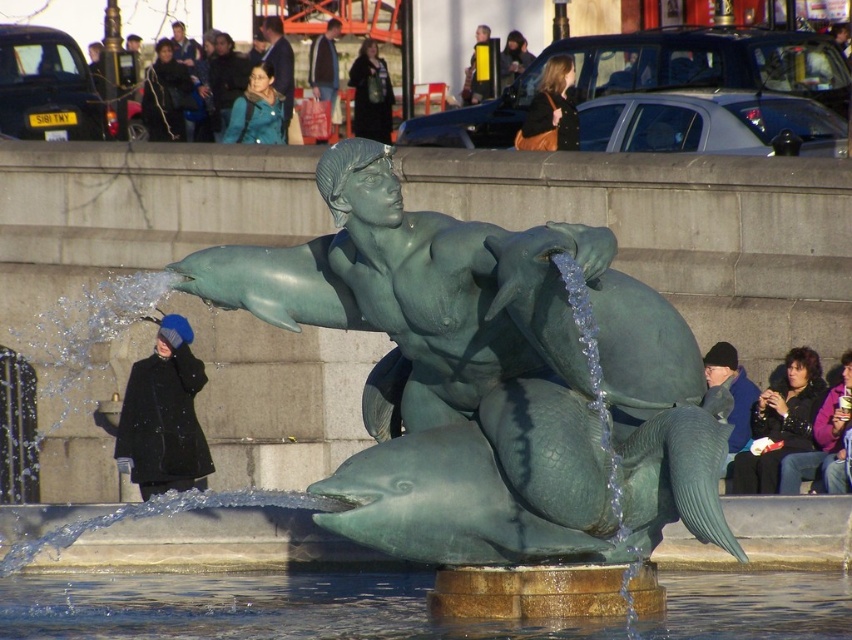
Consider the image. You are a city planner who needs to install a new bench for visitors. The green patina statue at center is an important landmark. There is a pathway that is 57.23 meters away from the statue. Is the pathway far enough for a bench to be placed there so that visitors can still see the statue clearly from the bench?

The pathway is 57.23 meters away from the green patina statue at center. Since the statue is the central landmark, placing a bench at this distance would allow visitors to have a clear view of the statue from the bench, as the distance is sufficient for visibility.

You are a delivery person who needs to place a matte brown purse at upper center onto the green patina statue at center. Given that the statue is on a stone pedestal partially submerged in water, can you reach the statue from the purse without getting wet?

The green patina statue at center is 155.07 feet away from matte brown purse at upper center. Since the distance is quite large, you would need to traverse a significant distance, but the statue is on a stone pedestal partially submerged in water. However, the description does not mention any water between the statue and the purse, so theoretically, you could reach the statue without getting wet if there is a dry path available.